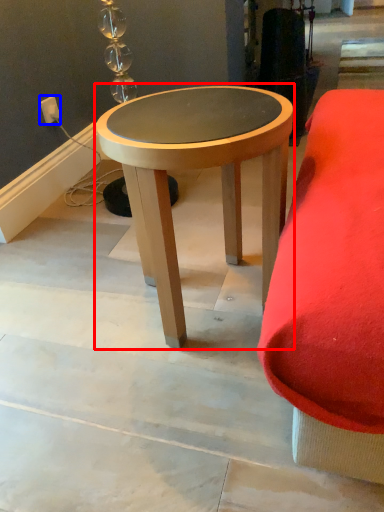
Question: Which point is further to the camera, coffee table (highlighted by a red box) or electric outlet (highlighted by a blue box)?

Choices:
 (A) coffee table
 (B) electric outlet

Answer: (B)